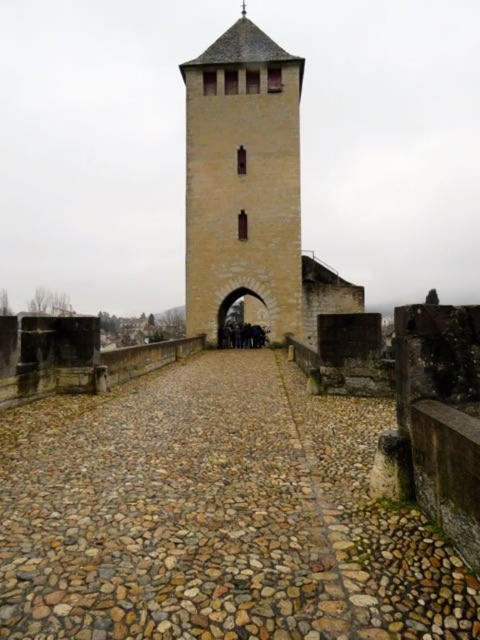
You are a traveler approaching the historic stone tower. You notice the brown cobblestone path at center and the smooth stone tower at center. Which one is taller?

The smooth stone tower at center is taller than the brown cobblestone path at center.

You are a delivery cart driver with a cart that is 2 meters wide. You need to drive through the area between the brown cobblestone path at center and the smooth stone tower at center. Can your cart fit through the space between them?

The brown cobblestone path at center might be wider than smooth stone tower at center, so there is a possibility that the cart can fit through the space between them. However, the exact width is uncertain based on the provided information.